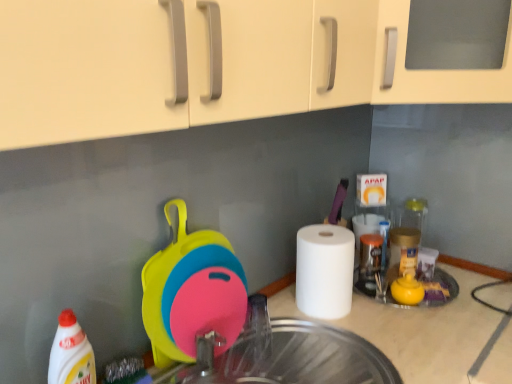
Question: Is white matte paper towel at right completely or partially outside of transparent glass sink at center?

Choices:
 (A) yes
 (B) no

Answer: (A)

Question: Is white matte paper towel at right taller than transparent glass sink at center?

Choices:
 (A) no
 (B) yes

Answer: (B)

Question: Is white matte paper towel at right to the right of transparent glass sink at center from the viewer's perspective?

Choices:
 (A) yes
 (B) no

Answer: (A)

Question: From the image's perspective, is white matte paper towel at right below transparent glass sink at center?

Choices:
 (A) no
 (B) yes

Answer: (A)

Question: From a real-world perspective, does white matte paper towel at right sit lower than transparent glass sink at center?

Choices:
 (A) no
 (B) yes

Answer: (A)

Question: Is transparent glass sink at center taller or shorter than metallic silver faucet at center?

Choices:
 (A) short
 (B) tall

Answer: (B)

Question: In terms of size, does transparent glass sink at center appear bigger or smaller than metallic silver faucet at center?

Choices:
 (A) small
 (B) big

Answer: (B)

Question: Which is correct: transparent glass sink at center is inside metallic silver faucet at center, or outside of it?

Choices:
 (A) outside
 (B) inside

Answer: (A)

Question: Looking at their shapes, would you say transparent glass sink at center is wider or thinner than metallic silver faucet at center?

Choices:
 (A) wide
 (B) thin

Answer: (A)

Question: From the image's perspective, is transparent glass sink at center positioned above or below silicone cutting board at center?

Choices:
 (A) below
 (B) above

Answer: (A)

Question: Is transparent glass sink at center in front of or behind silicone cutting board at center in the image?

Choices:
 (A) front
 (B) behind

Answer: (A)

Question: Does point (351, 357) appear closer or farther from the camera than point (173, 244)?

Choices:
 (A) closer
 (B) farther

Answer: (B)

Question: Considering the positions of transparent glass sink at center and silicone cutting board at center in the image, is transparent glass sink at center taller or shorter than silicone cutting board at center?

Choices:
 (A) short
 (B) tall

Answer: (A)

Question: Is white matte paper towel at right in front of or behind transparent glass sink at center in the image?

Choices:
 (A) front
 (B) behind

Answer: (B)

Question: From a real-world perspective, is white matte paper towel at right positioned above or below transparent glass sink at center?

Choices:
 (A) above
 (B) below

Answer: (A)